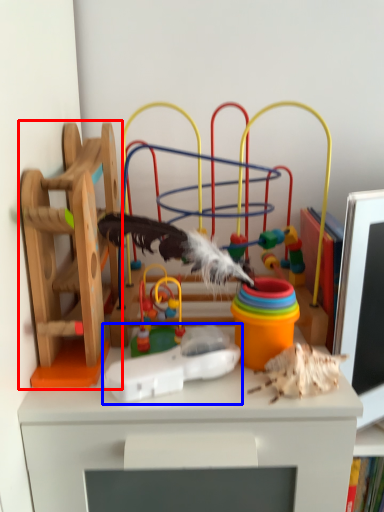
Question: Which of the following is the closest to the observer, toy (highlighted by a red box) or toy (highlighted by a blue box)?

Choices:
 (A) toy
 (B) toy

Answer: (A)